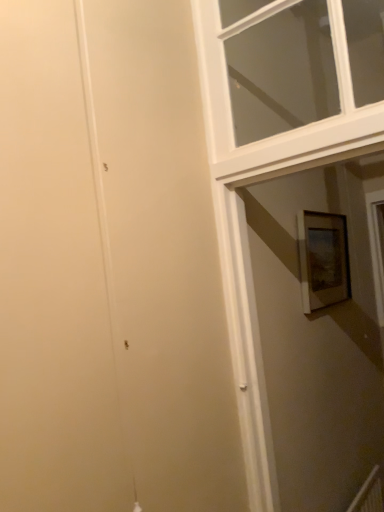
Question: Considering the relative positions of wooden framed picture at right and white wooden window at upper right in the image provided, is wooden framed picture at right in front of white wooden window at upper right?

Choices:
 (A) yes
 (B) no

Answer: (B)

Question: From a real-world perspective, is wooden framed picture at right located beneath white wooden window at upper right?

Choices:
 (A) no
 (B) yes

Answer: (B)

Question: Can you confirm if wooden framed picture at right is thinner than white wooden window at upper right?

Choices:
 (A) yes
 (B) no

Answer: (A)

Question: Could you tell me if wooden framed picture at right is turned towards white wooden window at upper right?

Choices:
 (A) yes
 (B) no

Answer: (B)

Question: Is wooden framed picture at right not within white wooden window at upper right?

Choices:
 (A) yes
 (B) no

Answer: (A)

Question: Is wooden framed picture at right with white wooden window at upper right?

Choices:
 (A) no
 (B) yes

Answer: (A)

Question: Is white wooden window at upper right outside wooden framed picture at right?

Choices:
 (A) no
 (B) yes

Answer: (B)

Question: Does white wooden window at upper right have a lesser width compared to wooden framed picture at right?

Choices:
 (A) no
 (B) yes

Answer: (A)

Question: Is white wooden window at upper right bigger than wooden framed picture at right?

Choices:
 (A) yes
 (B) no

Answer: (A)

Question: Does white wooden window at upper right appear on the right side of wooden framed picture at right?

Choices:
 (A) no
 (B) yes

Answer: (A)

Question: Considering the relative sizes of white wooden window at upper right and wooden framed picture at right in the image provided, is white wooden window at upper right shorter than wooden framed picture at right?

Choices:
 (A) no
 (B) yes

Answer: (A)

Question: Could you tell me if white wooden window at upper right is turned towards wooden framed picture at right?

Choices:
 (A) no
 (B) yes

Answer: (A)

Question: Is point (317, 298) positioned closer to the camera than point (201, 78)?

Choices:
 (A) farther
 (B) closer

Answer: (A)